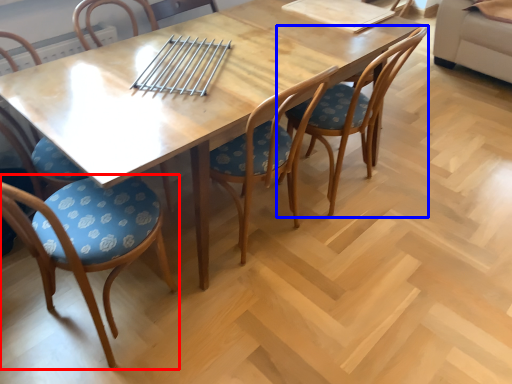
Question: Which object is further to the camera taking this photo, chair (highlighted by a red box) or chair (highlighted by a blue box)?

Choices:
 (A) chair
 (B) chair

Answer: (B)